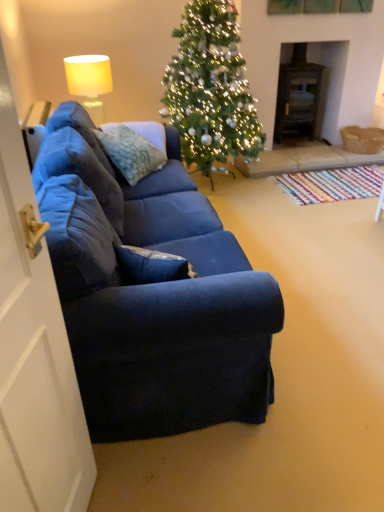
Where is `textured blue pillow at center`? This screenshot has width=384, height=512. textured blue pillow at center is located at coordinates (130, 152).

How many degrees apart are the facing directions of green matte christmas tree at center and dark wood fireplace at center right?

The angular difference between green matte christmas tree at center and dark wood fireplace at center right is 0.432 degrees.

Is green matte christmas tree at center in front of dark wood fireplace at center right?

Yes, green matte christmas tree at center is closer to the viewer.

Considering the sizes of objects green matte christmas tree at center and dark wood fireplace at center right in the image provided, who is shorter, green matte christmas tree at center or dark wood fireplace at center right?

dark wood fireplace at center right is shorter.

Is dark wood fireplace at center right shorter than matte yellow fabric lampshade at upper left?

No.

From a real-world perspective, is dark wood fireplace at center right located higher than matte yellow fabric lampshade at upper left?

No, from a real-world perspective, dark wood fireplace at center right is not on top of matte yellow fabric lampshade at upper left.

In the scene shown: Between dark wood fireplace at center right and matte yellow fabric lampshade at upper left, which one has larger size?

dark wood fireplace at center right.

Does green matte christmas tree at center turn towards matte yellow fabric lampshade at upper left?

No, green matte christmas tree at center is not facing towards matte yellow fabric lampshade at upper left.

This screenshot has width=384, height=512. I want to click on lamp on the left of green matte christmas tree at center, so click(x=90, y=82).

From the image's perspective, which one is positioned lower, green matte christmas tree at center or matte yellow fabric lampshade at upper left?

From the image's view, matte yellow fabric lampshade at upper left is below.

Is matte yellow fabric lampshade at upper left located outside white matte door at left?

Yes, matte yellow fabric lampshade at upper left is located beyond the bounds of white matte door at left.

Which object is further away from the camera taking this photo, matte yellow fabric lampshade at upper left or white matte door at left?

matte yellow fabric lampshade at upper left is behind.

Measure the distance between matte yellow fabric lampshade at upper left and white matte door at left.

matte yellow fabric lampshade at upper left and white matte door at left are 2.55 meters apart from each other.

From the image's perspective, relative to white matte door at left, is matte yellow fabric lampshade at upper left above or below?

Clearly, from the image's perspective, matte yellow fabric lampshade at upper left is above white matte door at left.

Does textured blue pillow at center turn towards matte yellow fabric lampshade at upper left?

No, textured blue pillow at center is not facing towards matte yellow fabric lampshade at upper left.

Is matte yellow fabric lampshade at upper left surrounded by textured blue pillow at center?

No, matte yellow fabric lampshade at upper left is located outside of textured blue pillow at center.

In the image, is textured blue pillow at center positioned in front of or behind matte yellow fabric lampshade at upper left?

In the image, textured blue pillow at center appears in front of matte yellow fabric lampshade at upper left.

From the image's perspective, is white matte door at left positioned above or below textured blue pillow at center?

white matte door at left is below textured blue pillow at center.

In the image, is white matte door at left positioned in front of or behind textured blue pillow at center?

In the image, white matte door at left appears in front of textured blue pillow at center.

From the picture: Considering the sizes of objects white matte door at left and textured blue pillow at center in the image provided, who is smaller, white matte door at left or textured blue pillow at center?

white matte door at left.

Between white matte door at left and textured blue pillow at center, which one appears on the left side from the viewer's perspective?

textured blue pillow at center.

Are matte yellow fabric lampshade at upper left and dark wood fireplace at center right located far from each other?

Absolutely, matte yellow fabric lampshade at upper left is distant from dark wood fireplace at center right.

From a real-world perspective, relative to dark wood fireplace at center right, is matte yellow fabric lampshade at upper left vertically above or below?

Clearly, from a real-world perspective, matte yellow fabric lampshade at upper left is above dark wood fireplace at center right.

Considering the sizes of objects matte yellow fabric lampshade at upper left and dark wood fireplace at center right in the image provided, who is wider, matte yellow fabric lampshade at upper left or dark wood fireplace at center right?

dark wood fireplace at center right.

At what (x,y) coordinates should I click in order to perform the action: click on christmas tree located on the left of dark wood fireplace at center right. Please return your answer as a coordinate pair (x, y). Looking at the image, I should click on (211, 89).

Image resolution: width=384 pixels, height=512 pixels. Find the location of `fireplace behind the matte yellow fabric lampshade at upper left`. fireplace behind the matte yellow fabric lampshade at upper left is located at coordinates (310, 89).

When comparing their distances from dark wood fireplace at center right, does textured blue pillow at center or matte yellow fabric lampshade at upper left seem further?

The object further to dark wood fireplace at center right is textured blue pillow at center.

Which object lies nearer to the anchor point dark wood fireplace at center right, green matte christmas tree at center or textured blue pillow at center?

green matte christmas tree at center is positioned closer to the anchor dark wood fireplace at center right.

Looking at the image, which one is located closer to matte yellow fabric lampshade at upper left, green matte christmas tree at center or textured blue pillow at center?

Among the two, textured blue pillow at center is located nearer to matte yellow fabric lampshade at upper left.

When comparing their distances from matte yellow fabric lampshade at upper left, does white matte door at left or textured blue pillow at center seem closer?

The object closer to matte yellow fabric lampshade at upper left is textured blue pillow at center.

Consider the image. Looking at the image, which one is located closer to green matte christmas tree at center, matte yellow fabric lampshade at upper left or dark wood fireplace at center right?

matte yellow fabric lampshade at upper left is positioned closer to the anchor green matte christmas tree at center.

When comparing their distances from textured blue pillow at center, does green matte christmas tree at center or dark wood fireplace at center right seem closer?

green matte christmas tree at center.

Estimate the real-world distances between objects in this image. Which object is closer to matte yellow fabric lampshade at upper left, green matte christmas tree at center or white matte door at left?

The object closer to matte yellow fabric lampshade at upper left is green matte christmas tree at center.

In the scene shown: From the image, which object appears to be nearer to textured blue pillow at center, matte yellow fabric lampshade at upper left or white matte door at left?

A: Among the two, matte yellow fabric lampshade at upper left is located nearer to textured blue pillow at center.

Locate an element on the screen. The height and width of the screenshot is (512, 384). pillow positioned between white matte door at left and matte yellow fabric lampshade at upper left from near to far is located at coordinates [x=130, y=152].

Find the location of a particular element. The image size is (384, 512). christmas tree between textured blue pillow at center and dark wood fireplace at center right in the horizontal direction is located at coordinates (211, 89).

At what (x,y) coordinates should I click in order to perform the action: click on pillow located between matte yellow fabric lampshade at upper left and green matte christmas tree at center in the left-right direction. Please return your answer as a coordinate pair (x, y). This screenshot has height=512, width=384. Looking at the image, I should click on (130, 152).

The width and height of the screenshot is (384, 512). I want to click on christmas tree between white matte door at left and matte yellow fabric lampshade at upper left in the front-back direction, so click(x=211, y=89).